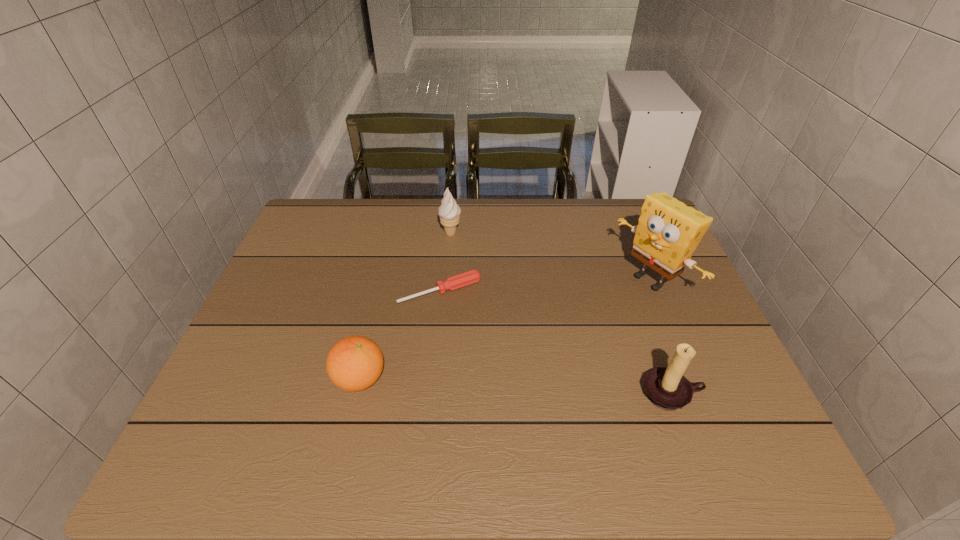
I want to click on blank space located 0.340m on the face of the tallest object, so click(533, 358).

Identify the location of free space located on the face of the tallest object. (590, 323).

Where is `free region located 0.060m at the tip of the shortest object`? This screenshot has height=540, width=960. free region located 0.060m at the tip of the shortest object is located at coordinates (467, 321).

The width and height of the screenshot is (960, 540). I want to click on free space located at the tip of the shortest object, so click(487, 355).

What are the coordinates of `free space located 0.220m at the tip of the shortest object` in the screenshot? It's located at (494, 368).

In order to click on object present at the far edge in this screenshot , I will do click(449, 211).

Find the location of a particular element. orange located at the near edge is located at coordinates (354, 363).

Where is `candle holder that is positioned at the near edge`? This screenshot has height=540, width=960. candle holder that is positioned at the near edge is located at coordinates (666, 387).

Image resolution: width=960 pixels, height=540 pixels. Identify the location of candle holder that is at the right edge. (666, 387).

Where is `sponge situated at the right edge`? The height and width of the screenshot is (540, 960). sponge situated at the right edge is located at coordinates (668, 232).